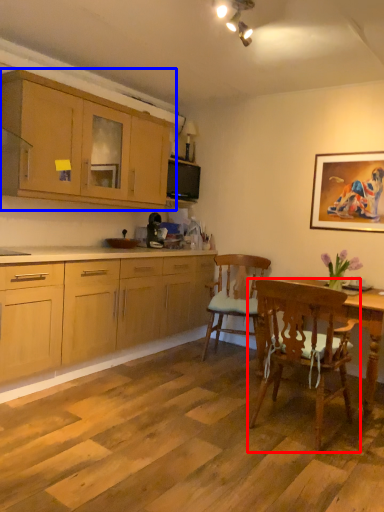
Question: Which object appears farthest to the camera in this image, chair (highlighted by a red box) or cabinetry (highlighted by a blue box)?

Choices:
 (A) chair
 (B) cabinetry

Answer: (B)